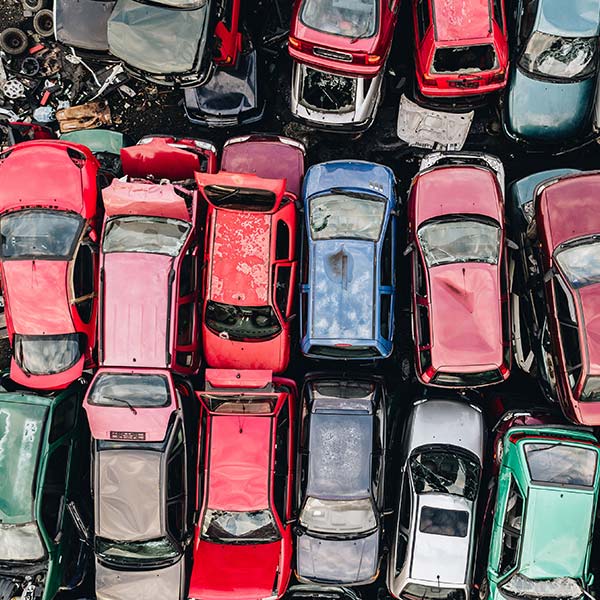
Image resolution: width=600 pixels, height=600 pixels. I want to click on back window, so click(345, 399), click(558, 462), click(589, 387), click(473, 378), click(52, 362), click(348, 24).